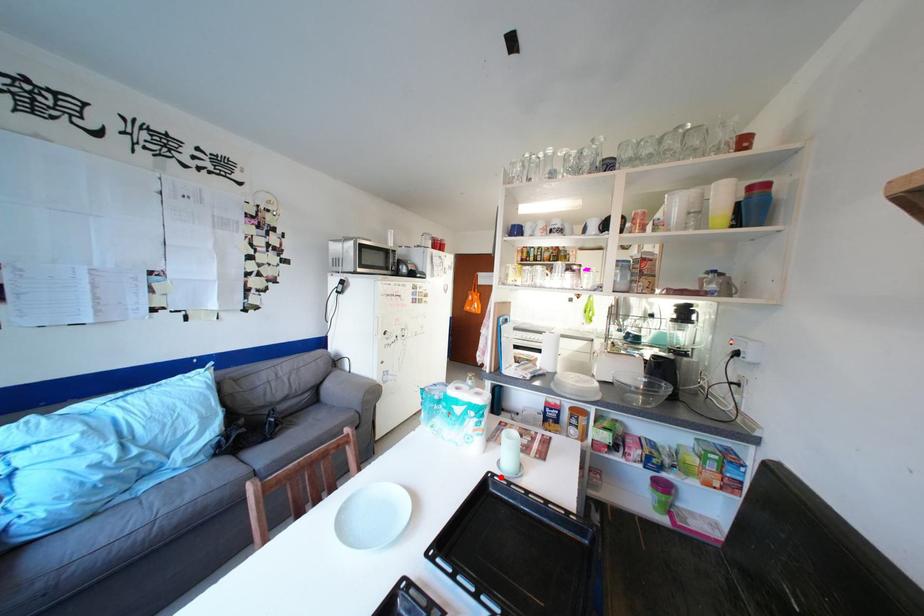
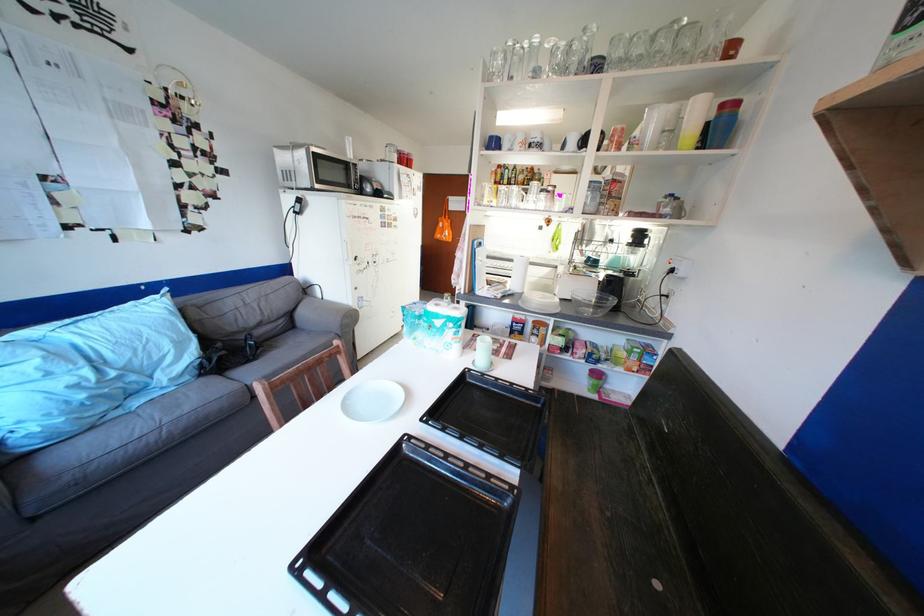
Locate, in the second image, the point that corresponds to the highlighted location in the first image.

(477, 371)